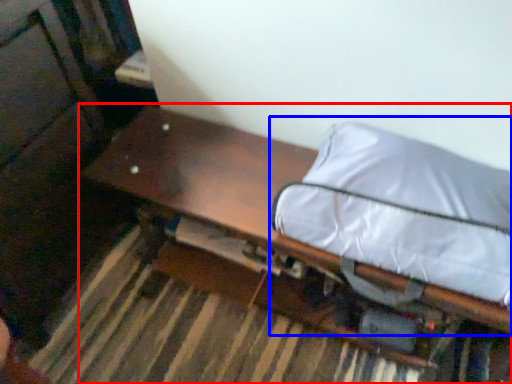
Question: Which object is further to the camera taking this photo, furniture (highlighted by a red box) or bean bag chair (highlighted by a blue box)?

Choices:
 (A) furniture
 (B) bean bag chair

Answer: (A)